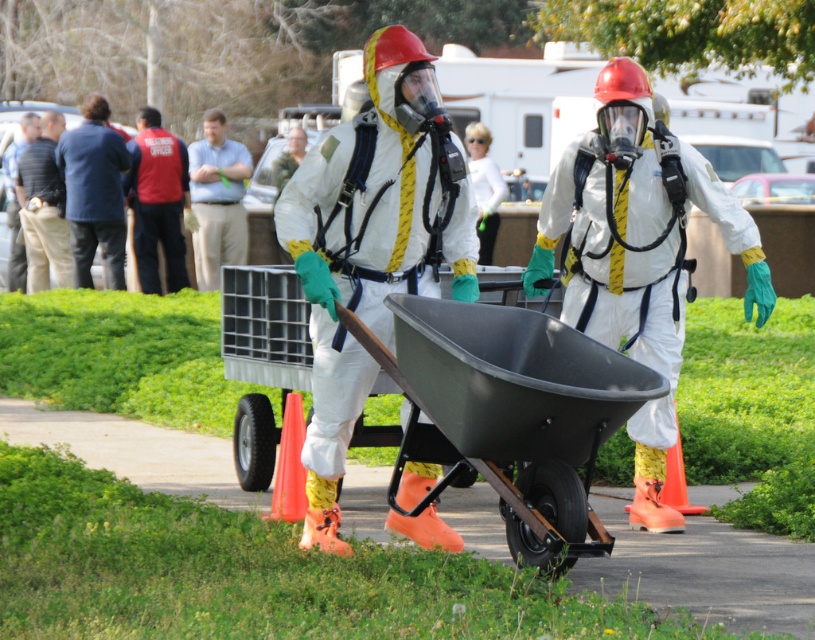
Does white matte hazmat suit at center come in front of striped shirt at left?

Yes, white matte hazmat suit at center is in front of striped shirt at left.

Does white matte hazmat suit at center appear over striped shirt at left?

Incorrect, white matte hazmat suit at center is not positioned above striped shirt at left.

Which is behind, point (681, 513) or point (36, 160)?

Positioned behind is point (36, 160).

The image size is (815, 640). I want to click on white matte hazmat suit at center, so click(637, 253).

Which is in front, point (631, 522) or point (69, 195)?

Point (631, 522) is in front.

Find the location of a particular element. white matte hazmat suit at center is located at coordinates (637, 253).

Is white matte hazmat suit at center to the left of light blue shirt at center from the viewer's perspective?

Incorrect, white matte hazmat suit at center is not on the left side of light blue shirt at center.

Can you confirm if white matte hazmat suit at center is positioned above light blue shirt at center?

No, white matte hazmat suit at center is not above light blue shirt at center.

Locate an element on the screen. white matte hazmat suit at center is located at coordinates (637, 253).